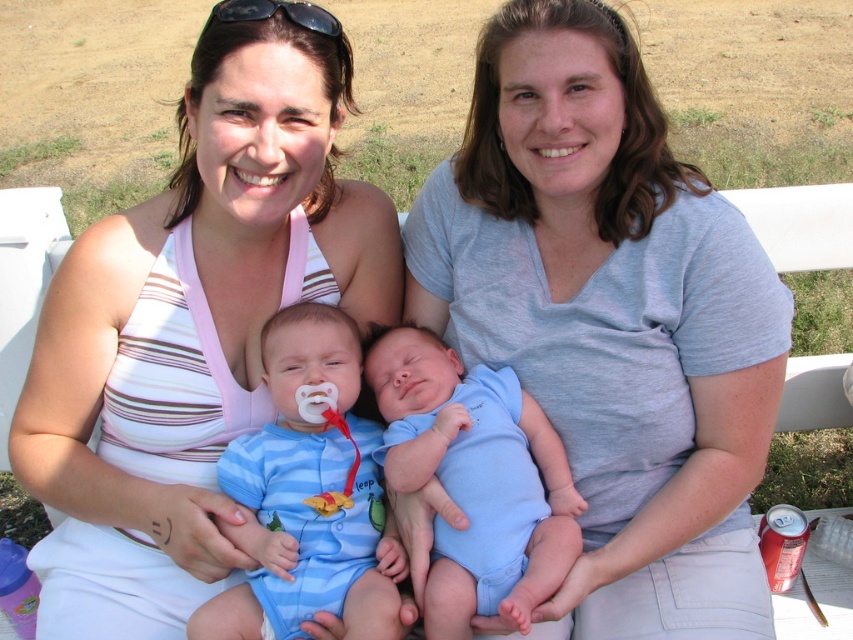
Question: Which of the following is the closest to the observer?

Choices:
 (A) black plastic sunglasses at upper center
 (B) blue soft fabric newborn at center

Answer: (B)

Question: Among these points, which one is farthest from the camera?

Choices:
 (A) (654, 147)
 (B) (234, 433)

Answer: (B)

Question: Is the position of blue cotton onesie at center less distant than that of blue soft fabric newborn at center?

Choices:
 (A) no
 (B) yes

Answer: (A)

Question: Can you confirm if blue soft fabric newborn at center is positioned below black plastic sunglasses at upper center?

Choices:
 (A) no
 (B) yes

Answer: (B)

Question: Estimate the real-world distances between objects in this image. Which object is farther from the white striped tank top at center?

Choices:
 (A) black plastic sunglasses at upper center
 (B) blue soft fabric newborn at center

Answer: (A)

Question: Can you confirm if gray cotton shirt at center is positioned above white striped tank top at center?

Choices:
 (A) yes
 (B) no

Answer: (A)